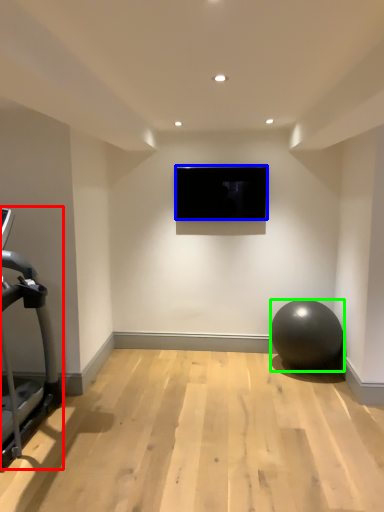
Question: Estimate the real-world distances between objects in this image. Which object is farther from treadmill (highlighted by a red box), television (highlighted by a blue box) or ball (highlighted by a green box)?

Choices:
 (A) television
 (B) ball

Answer: (B)